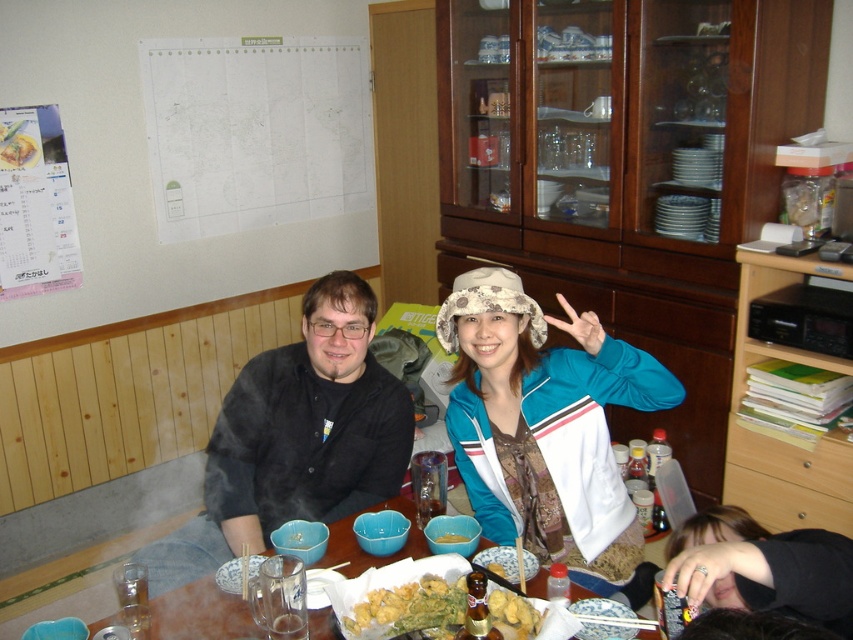
Question: Can you confirm if white paper map at upper center is positioned below golden crispy tempura at center?

Choices:
 (A) yes
 (B) no

Answer: (B)

Question: Among these objects, which one is nearest to the camera?

Choices:
 (A) white paper map at upper center
 (B) yellow matte rice bowl at center
 (C) blue fabric jacket at center
 (D) black matte jacket at center

Answer: (C)

Question: Among these points, which one is farthest from the camera?

Choices:
 (A) (184, 144)
 (B) (519, 618)

Answer: (A)

Question: Which object is farther from the camera taking this photo?

Choices:
 (A) blue fabric jacket at center
 (B) wooden table at center
 (C) golden crispy tempura at center
 (D) black matte jacket at center

Answer: (D)

Question: Considering the relative positions of white paper map at upper center and yellow matte rice bowl at center in the image provided, where is white paper map at upper center located with respect to yellow matte rice bowl at center?

Choices:
 (A) right
 (B) left

Answer: (B)

Question: In this image, where is blue fabric jacket at center located relative to wooden table at center?

Choices:
 (A) right
 (B) left

Answer: (A)